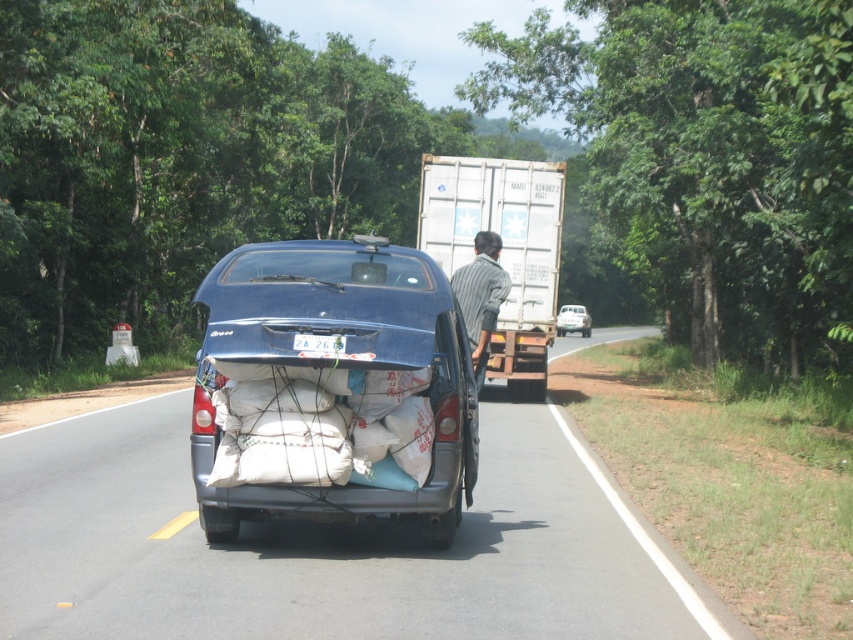
Question: Can you confirm if white matte container at center is wider than metallic silver van at center?

Choices:
 (A) yes
 (B) no

Answer: (B)

Question: Estimate the real-world distances between objects in this image. Which object is farther from the metallic silver van at center?

Choices:
 (A) matte blue car at center
 (B) white matte container at center
 (C) striped fabric shirt at center

Answer: (C)

Question: Does matte blue car at center appear on the right side of striped fabric shirt at center?

Choices:
 (A) no
 (B) yes

Answer: (A)

Question: Which object is farther from the camera taking this photo?

Choices:
 (A) white matte container at center
 (B) striped fabric shirt at center
 (C) matte blue car at center

Answer: (A)

Question: Which point is closer to the camera taking this photo?

Choices:
 (A) (292, 264)
 (B) (434, 193)

Answer: (A)

Question: From the image, what is the correct spatial relationship of white matte container at center in relation to metallic silver van at center?

Choices:
 (A) right
 (B) left

Answer: (B)